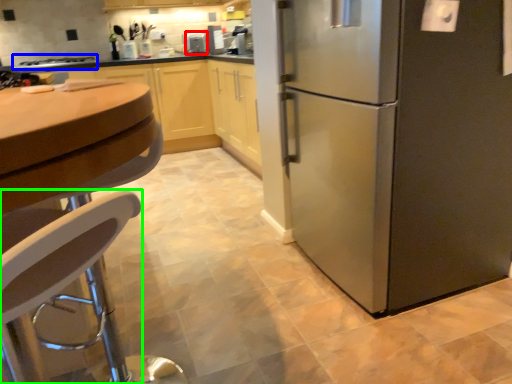
Question: Based on their relative distances, which object is farther from appliance (highlighted by a red box)? Choose from stove (highlighted by a blue box) and chair (highlighted by a green box).

Choices:
 (A) stove
 (B) chair

Answer: (B)